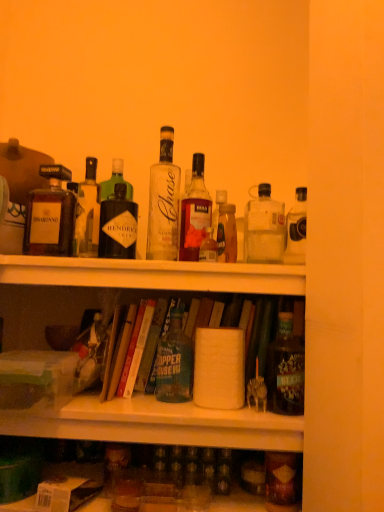
Question: Considering the positions of matte brown bottle at left, which ranks as the 1th bottle in left-to-right order, and white matte shelf at upper center in the image, is matte brown bottle at left, which ranks as the 1th bottle in left-to-right order, bigger or smaller than white matte shelf at upper center?

Choices:
 (A) small
 (B) big

Answer: (A)

Question: Looking at their shapes, would you say matte brown bottle at left, arranged as the ninth bottle when viewed from the right, is wider or thinner than white matte shelf at upper center?

Choices:
 (A) thin
 (B) wide

Answer: (A)

Question: Which of these objects is positioned farthest from the matte black bottle at right, which ranks as the 9th bottle in left-to-right order?

Choices:
 (A) translucent glass bottle at center, placed as the fifth bottle when sorted from right to left
 (B) white matte toilet paper at center
 (C) clear glass bottle at upper left, arranged as the 8th bottle when viewed from the right
 (D) clear glass bottle at center, which ranks as the third bottle in left-to-right order
 (E) matte brown bottle at lower right, acting as the 8th bottle starting from the left

Answer: (C)

Question: Based on their relative distances, which object is farther from the clear glass bottle at upper left, arranged as the 8th bottle when viewed from the right?

Choices:
 (A) green cardboard box at lower left, positioned as the first box in top-to-bottom order
 (B) matte brown bottle at lower right, acting as the 8th bottle starting from the left
 (C) translucent glass bottle at center, which is the fourth bottle from right to left
 (D) green matte bottle at center, marked as the 6th bottle in a right-to-left arrangement
 (E) matte black bottle at right, placed as the first bottle when sorted from right to left

Answer: (B)